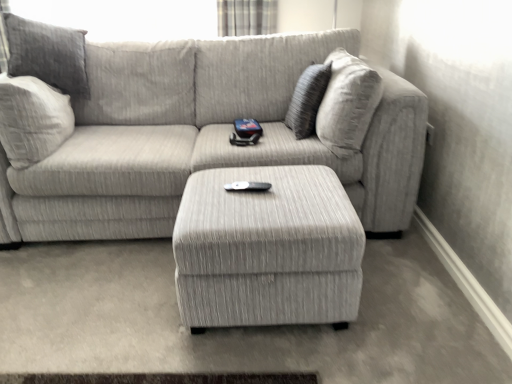
Describe the element at coordinates (307, 100) in the screenshot. I see `beige fabric pillow at upper right` at that location.

Measure the distance between textured gray couch at center and camera.

textured gray couch at center is 1.71 meters from camera.

Measure the distance between point (10, 45) and camera.

The depth of point (10, 45) is 6.21 feet.

The height and width of the screenshot is (384, 512). What do you see at coordinates (267, 249) in the screenshot? I see `textured gray ottoman at center` at bounding box center [267, 249].

Locate an element on the screen. The height and width of the screenshot is (384, 512). beige fabric pillow at upper right is located at coordinates (307, 100).

Considering the positions of point (150, 221) and point (210, 235), is point (150, 221) closer or farther from the camera than point (210, 235)?

Point (150, 221) is positioned farther from the camera compared to point (210, 235).

Image resolution: width=512 pixels, height=384 pixels. Identify the location of studio couch behind the textured gray ottoman at center. (191, 131).

Is textured gray couch at center not inside textured gray ottoman at center?

Yes, textured gray couch at center is outside of textured gray ottoman at center.

Between textured gray ottoman at center and beige fabric pillow at upper right, which one has smaller size?

beige fabric pillow at upper right is smaller.

Can you confirm if textured gray ottoman at center is taller than beige fabric pillow at upper right?

Incorrect, the height of textured gray ottoman at center is not larger of that of beige fabric pillow at upper right.

Is textured gray ottoman at center closer to camera compared to beige fabric pillow at upper right?

Yes, textured gray ottoman at center is closer to the viewer.

Which of these two, textured gray ottoman at center or beige fabric pillow at upper right, is thinner?

With smaller width is beige fabric pillow at upper right.

Which point is more distant from viewer, [201,126] or [311,122]?

The point [201,126] is more distant.

Does textured gray couch at center appear on the left side of beige fabric pillow at upper right?

Indeed, textured gray couch at center is positioned on the left side of beige fabric pillow at upper right.

Can you confirm if textured gray couch at center is taller than beige fabric pillow at upper right?

Indeed, textured gray couch at center has a greater height compared to beige fabric pillow at upper right.

In terms of size, does textured gray couch at center appear bigger or smaller than beige fabric pillow at upper right?

textured gray couch at center is bigger than beige fabric pillow at upper right.

Is plaid fabric curtain at upper center positioned far away from textured gray ottoman at center?

plaid fabric curtain at upper center is far away from textured gray ottoman at center.

Considering the points (276, 14) and (221, 313), which point is behind, point (276, 14) or point (221, 313)?

Point (276, 14)

Where is `curtain on the left of textured gray ottoman at center`? curtain on the left of textured gray ottoman at center is located at coordinates (246, 17).

Which is behind, plaid fabric curtain at upper center or textured gray ottoman at center?

Positioned behind is plaid fabric curtain at upper center.

How different are the orientations of textured gray couch at center and plaid fabric curtain at upper center in degrees?

There is a 4.1-degree angle between the facing directions of textured gray couch at center and plaid fabric curtain at upper center.

Who is shorter, textured gray couch at center or plaid fabric curtain at upper center?

Standing shorter between the two is plaid fabric curtain at upper center.

Does textured gray couch at center contain plaid fabric curtain at upper center?

No, plaid fabric curtain at upper center is not inside textured gray couch at center.

Considering the points (306, 88) and (59, 35), which point is in front, point (306, 88) or point (59, 35)?

The point (306, 88) is closer.

Considering the positions of objects beige fabric pillow at upper right and textured gray couch at center in the image provided, who is more to the left, beige fabric pillow at upper right or textured gray couch at center?

textured gray couch at center.

Identify the location of studio couch that appears below the beige fabric pillow at upper right (from a real-world perspective). (191, 131).

Can we say beige fabric pillow at upper right lies outside textured gray couch at center?

No, most part of beige fabric pillow at upper right lies within textured gray couch at center.

Between textured gray ottoman at center and plaid fabric curtain at upper center, which one appears on the right side from the viewer's perspective?

From the viewer's perspective, textured gray ottoman at center appears more on the right side.

Are textured gray ottoman at center and plaid fabric curtain at upper center beside each other?

textured gray ottoman at center is not next to plaid fabric curtain at upper center, and they're not touching.

Looking at the image, does textured gray ottoman at center seem bigger or smaller compared to plaid fabric curtain at upper center?

Clearly, textured gray ottoman at center is larger in size than plaid fabric curtain at upper center.

How many degrees apart are the facing directions of textured gray ottoman at center and plaid fabric curtain at upper center?

3.15 degrees.

Find the location of a particular element. The height and width of the screenshot is (384, 512). table below the textured gray couch at center (from the image's perspective) is located at coordinates (267, 249).

At what (x,y) coordinates should I click in order to perform the action: click on pillow to the right of textured gray ottoman at center. Please return your answer as a coordinate pair (x, y). The width and height of the screenshot is (512, 384). Looking at the image, I should click on (307, 100).

From the image, which object appears to be nearer to textured gray ottoman at center, beige fabric pillow at upper right or plaid fabric curtain at upper center?

beige fabric pillow at upper right is closer to textured gray ottoman at center.

From the image, which object appears to be farther from textured gray ottoman at center, textured gray couch at center or plaid fabric curtain at upper center?

plaid fabric curtain at upper center lies further to textured gray ottoman at center than the other object.

Looking at the image, which one is located further to textured gray couch at center, beige fabric pillow at upper right or plaid fabric curtain at upper center?

Among the two, plaid fabric curtain at upper center is located further to textured gray couch at center.

Considering their positions, is textured gray ottoman at center positioned closer to plaid fabric curtain at upper center than textured gray couch at center?

Among the two, textured gray couch at center is located nearer to plaid fabric curtain at upper center.

When comparing their distances from plaid fabric curtain at upper center, does beige fabric pillow at upper right or textured gray ottoman at center seem further?

textured gray ottoman at center lies further to plaid fabric curtain at upper center than the other object.

Based on the photo, estimate the real-world distances between objects in this image. Which object is closer to plaid fabric curtain at upper center, beige fabric pillow at upper right or textured gray couch at center?

Among the two, textured gray couch at center is located nearer to plaid fabric curtain at upper center.

Considering their positions, is plaid fabric curtain at upper center positioned closer to textured gray ottoman at center than textured gray couch at center?

textured gray couch at center is closer to textured gray ottoman at center.

Looking at the image, which one is located closer to beige fabric pillow at upper right, plaid fabric curtain at upper center or textured gray couch at center?

The object closer to beige fabric pillow at upper right is textured gray couch at center.

Locate an element on the screen. Image resolution: width=512 pixels, height=384 pixels. studio couch between beige fabric pillow at upper right and textured gray ottoman at center vertically is located at coordinates click(x=191, y=131).

Locate an element on the screen. studio couch positioned between textured gray ottoman at center and plaid fabric curtain at upper center from near to far is located at coordinates (191, 131).

Find the location of a particular element. This screenshot has height=384, width=512. pillow between textured gray ottoman at center and plaid fabric curtain at upper center along the z-axis is located at coordinates (307, 100).

The image size is (512, 384). I want to click on pillow between textured gray couch at center and plaid fabric curtain at upper center along the z-axis, so click(x=307, y=100).